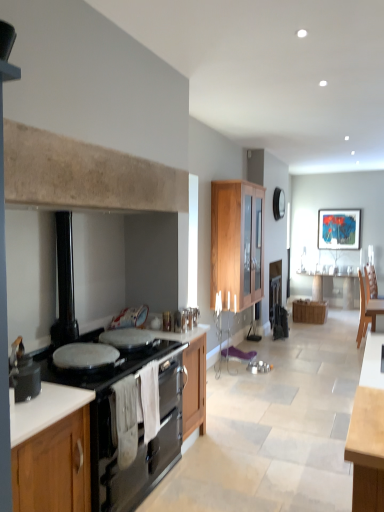
Question: Is point (215, 230) positioned closer to the camera than point (105, 333)?

Choices:
 (A) closer
 (B) farther

Answer: (B)

Question: Relative to black enamel stove at left, is wooden cabinet at center, the first cabinetry from the top, in front or behind?

Choices:
 (A) front
 (B) behind

Answer: (B)

Question: Which object is positioned farthest from the wooden cabinet at center, positioned as the second cabinetry in top-to-bottom order?

Choices:
 (A) wooden cabinet at center, which appears as the third cabinetry when ordered from the bottom
 (B) matte black pot at left
 (C) wooden chair at right
 (D) white glossy countertop at lower left, the second countertop positioned from the back
 (E) white glossy countertop at lower left, the 2th countertop from the top

Answer: (B)

Question: Estimate the real-world distances between objects in this image. Which object is closer to the white glossy countertop at lower left, arranged as the first countertop when viewed from the top?

Choices:
 (A) wooden cabinet at center, positioned as the second cabinetry in top-to-bottom order
 (B) metallic glossy picture frame at upper right
 (C) wooden cabinet at lower left, which is the third cabinetry in right-to-left order
 (D) white glossy countertop at lower left, which is counted as the first countertop, starting from the back
 (E) black enamel stove at left

Answer: (C)